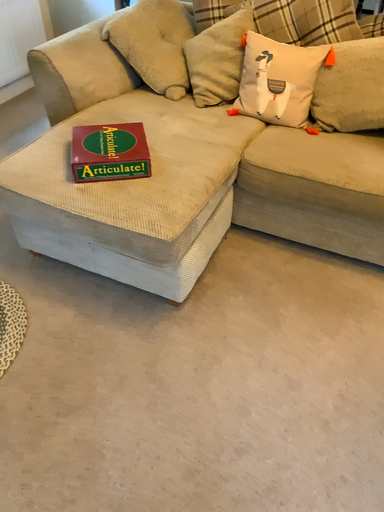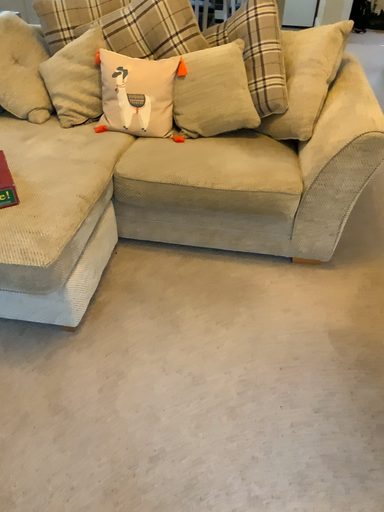
Question: Which way did the camera rotate in the video?

Choices:
 (A) rotated left
 (B) rotated right

Answer: (B)